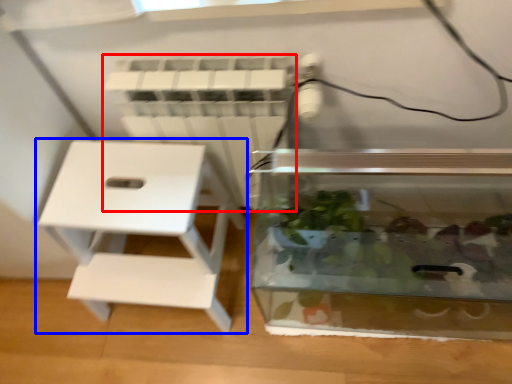
Question: Which point is closer to the camera, radiator (highlighted by a red box) or furniture (highlighted by a blue box)?

Choices:
 (A) radiator
 (B) furniture

Answer: (A)